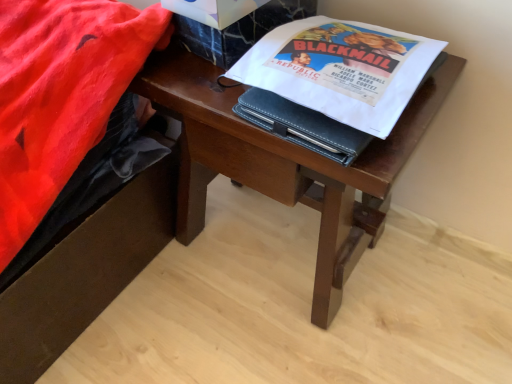
Locate an element on the screen. vacant location below wooden desk at center (from a real-world perspective) is located at coordinates (275, 241).